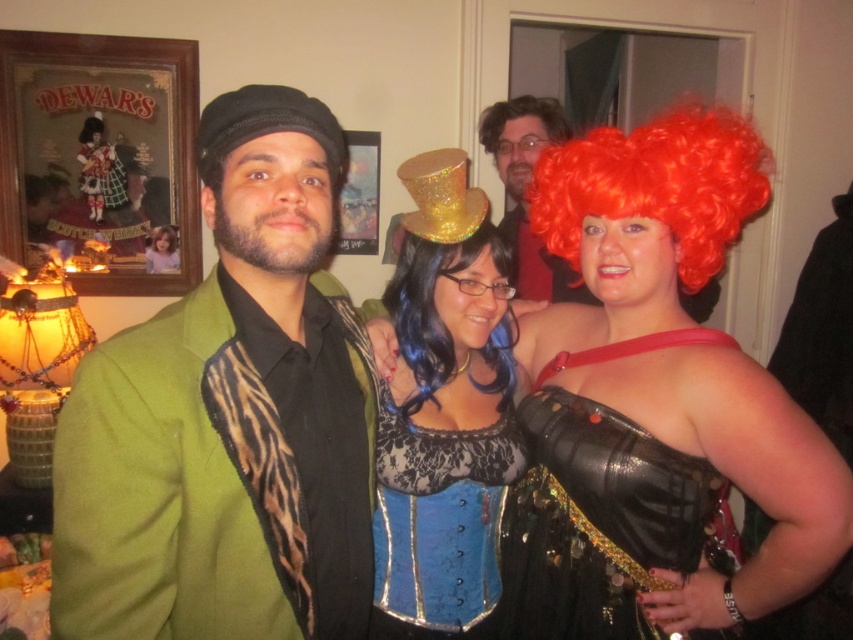
Does point (683, 177) lie behind point (601, 460)?

No, it is in front of (601, 460).

Who is positioned more to the left, shiny red wig at upper right or black leather glove at right?

shiny red wig at upper right

Does point (619, 365) come in front of point (619, 413)?

No, (619, 365) is further to viewer.

Identify the location of shiny red wig at upper right. (660, 394).

Can you confirm if black leather glove at right is positioned below bright orange curly wig at upper right?

Indeed, black leather glove at right is positioned under bright orange curly wig at upper right.

Does black leather glove at right appear over bright orange curly wig at upper right?

Incorrect, black leather glove at right is not positioned above bright orange curly wig at upper right.

In order to click on black leather glove at right in this screenshot , I will do `click(601, 509)`.

Is black leather glove at right above shiny gold top hat at upper center?

No, black leather glove at right is not above shiny gold top hat at upper center.

Who is higher up, black leather glove at right or shiny gold top hat at upper center?

Positioned higher is shiny gold top hat at upper center.

Does point (642, 486) lie behind point (517, 220)?

No.

At what (x,y) coordinates should I click in order to perform the action: click on black leather glove at right. Please return your answer as a coordinate pair (x, y). Looking at the image, I should click on (601, 509).